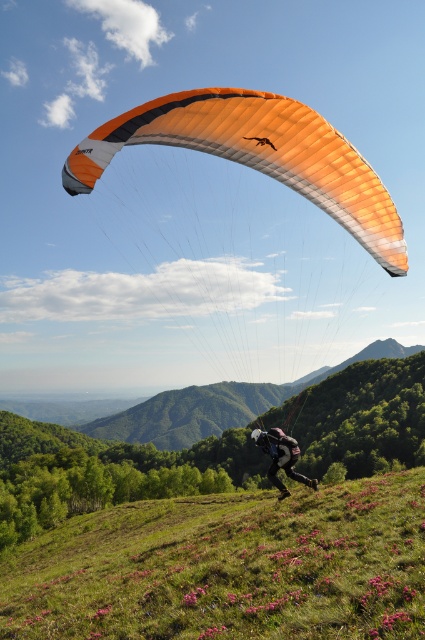
Question: Does orange fabric parachute at upper center appear on the right side of black fabric parachute at center?

Choices:
 (A) no
 (B) yes

Answer: (A)

Question: Is green grassy hillside at lower center behind black fabric parachute at center?

Choices:
 (A) no
 (B) yes

Answer: (A)

Question: Can you confirm if orange fabric parachute at upper center is bigger than black fabric parachute at center?

Choices:
 (A) no
 (B) yes

Answer: (B)

Question: Which point is farther to the camera?

Choices:
 (A) black fabric parachute at center
 (B) green grassy hillside at lower center
 (C) orange fabric parachute at upper center

Answer: (A)

Question: Which object is closer to the camera taking this photo?

Choices:
 (A) orange fabric parachute at upper center
 (B) black fabric parachute at center
 (C) green grassy hillside at lower center

Answer: (C)

Question: Estimate the real-world distances between objects in this image. Which object is farther from the green grassy hillside at lower center?

Choices:
 (A) black fabric parachute at center
 (B) orange fabric parachute at upper center

Answer: (B)